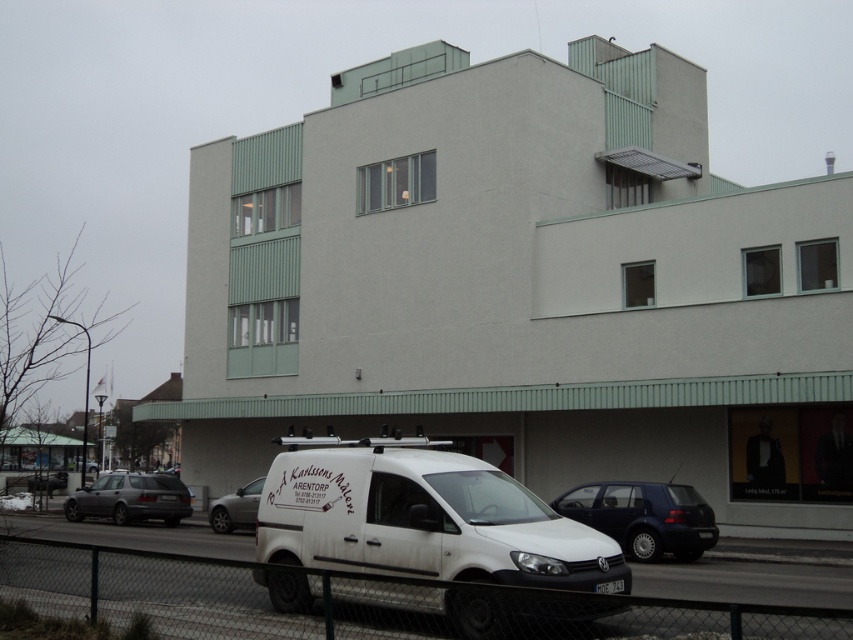
You are a delivery driver who needs to park in a narrow alley that can only accommodate vehicles up to 1.8 meters in width. You see a matte gray station wagon at lower left and a silver metallic car at center. Which vehicle should you choose to park in the alley?

The matte gray station wagon at lower left might be wider than silver metallic car at center, so you should choose the silver metallic car at center to park in the alley since it is likely under 1.8 meters.

You are standing at the point marked by the coordinates (361, 602) in the image. What object is exactly at that point?

The metallic chain link fence at lower center is located at point (361, 602).

From the picture: You are standing at the center of the image facing the building. There is a point marked at coordinates (131,499). What object is located at this point?

The point at coordinates (131,499) corresponds to the matte gray station wagon at lower left.